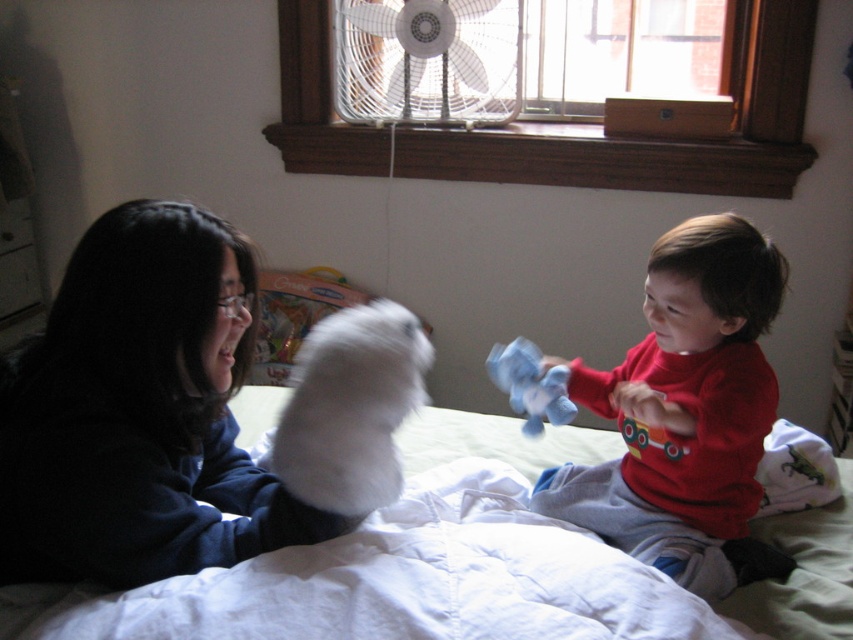
Is red cotton shirt at right to the left of blue plush toy at center from the viewer's perspective?

No, red cotton shirt at right is not to the left of blue plush toy at center.

Between red cotton shirt at right and blue plush toy at center, which one is positioned lower?

blue plush toy at center is below.

Between point (744, 266) and point (498, 349), which one is positioned behind?

Point (498, 349)

You are a GUI agent. You are given a task and a screenshot of the screen. Output one action in this format:
    pyautogui.click(x=<x>, y=<y>)
    Task: Click on the red cotton shirt at right
    Image resolution: width=853 pixels, height=640 pixels.
    Given the screenshot: What is the action you would take?
    pyautogui.click(x=685, y=413)

Does white fluffy glove at upper left have a larger size compared to white plastic fan at upper center?

Yes, white fluffy glove at upper left is bigger than white plastic fan at upper center.

Where is `white fluffy glove at upper left`? This screenshot has height=640, width=853. white fluffy glove at upper left is located at coordinates (140, 412).

Image resolution: width=853 pixels, height=640 pixels. Identify the location of white fluffy glove at upper left. (140, 412).

Find the location of a particular element. white quilted bed at center is located at coordinates (463, 566).

Is white quilted bed at center thinner than blue plush toy at center?

In fact, white quilted bed at center might be wider than blue plush toy at center.

Is point (531, 557) closer to camera compared to point (550, 385)?

Yes, it is.

Identify the location of white quilted bed at center. The image size is (853, 640). (463, 566).